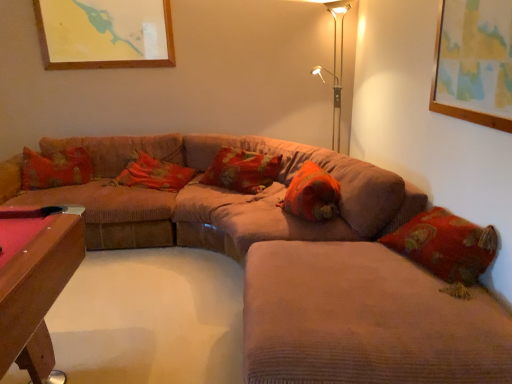
Question: In which direction should I rotate to look at floral fabric pillow at center, marked as the second pillow in a right-to-left arrangement?

Choices:
 (A) right
 (B) left

Answer: (B)

Question: From a real-world perspective, is corduroy couch at center, which ranks as the 2th couch in front-to-back order, under orange fabric pillow at center, marked as the 1th pillow in a right-to-left arrangement?

Choices:
 (A) yes
 (B) no

Answer: (A)

Question: Considering the relative positions of corduroy couch at center, marked as the first couch in a back-to-front arrangement, and orange fabric pillow at center, which ranks as the 3th pillow in left-to-right order, in the image provided, is corduroy couch at center, marked as the first couch in a back-to-front arrangement, behind orange fabric pillow at center, which ranks as the 3th pillow in left-to-right order,?

Choices:
 (A) no
 (B) yes

Answer: (A)

Question: Would you say orange fabric pillow at center, marked as the 1th pillow in a right-to-left arrangement, is part of corduroy couch at center, which ranks as the 2th couch in front-to-back order,'s contents?

Choices:
 (A) no
 (B) yes

Answer: (B)

Question: Is corduroy couch at center, which ranks as the 2th couch in front-to-back order, facing towards orange fabric pillow at center, which ranks as the 3th pillow in left-to-right order?

Choices:
 (A) yes
 (B) no

Answer: (A)

Question: Is corduroy couch at center, which ranks as the 2th couch in front-to-back order, outside orange fabric pillow at center, marked as the 1th pillow in a right-to-left arrangement?

Choices:
 (A) no
 (B) yes

Answer: (B)

Question: Does corduroy couch at center, marked as the first couch in a back-to-front arrangement, have a lesser width compared to orange fabric pillow at center, which ranks as the 3th pillow in left-to-right order?

Choices:
 (A) no
 (B) yes

Answer: (A)

Question: Does floral fabric pillow at center, marked as the second pillow in a right-to-left arrangement, appear on the right side of orange fabric pillow at center, marked as the 1th pillow in a right-to-left arrangement?

Choices:
 (A) no
 (B) yes

Answer: (A)

Question: Is floral fabric pillow at center, which is counted as the 2th pillow, starting from the left, not close to orange fabric pillow at center, marked as the 1th pillow in a right-to-left arrangement?

Choices:
 (A) yes
 (B) no

Answer: (B)

Question: Is floral fabric pillow at center, marked as the second pillow in a right-to-left arrangement, bigger than orange fabric pillow at center, which ranks as the 3th pillow in left-to-right order?

Choices:
 (A) no
 (B) yes

Answer: (B)

Question: Does floral fabric pillow at center, which is counted as the 2th pillow, starting from the left, turn towards orange fabric pillow at center, which ranks as the 3th pillow in left-to-right order?

Choices:
 (A) no
 (B) yes

Answer: (A)

Question: Does floral fabric pillow at center, marked as the second pillow in a right-to-left arrangement, lie behind orange fabric pillow at center, which ranks as the 3th pillow in left-to-right order?

Choices:
 (A) yes
 (B) no

Answer: (A)

Question: From the image's perspective, is floral fabric pillow at center, which is counted as the 2th pillow, starting from the left, located above orange fabric pillow at center, marked as the 1th pillow in a right-to-left arrangement?

Choices:
 (A) yes
 (B) no

Answer: (A)

Question: Is metallic gold table lamp at upper right positioned in front of corduroy couch at center, which ranks as the 2th couch in front-to-back order?

Choices:
 (A) no
 (B) yes

Answer: (A)